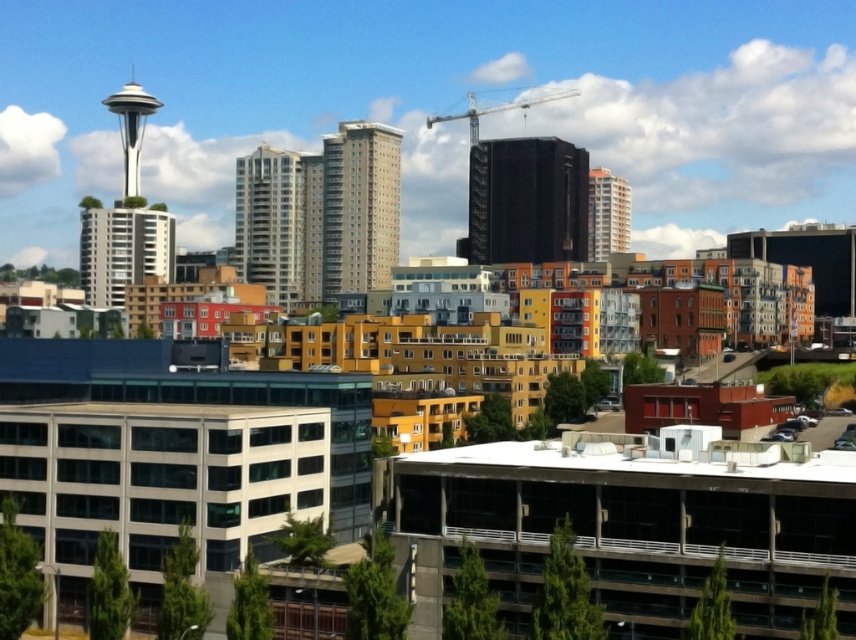
You are a city planner analyzing the urban layout. Given the coordinates provided for the black glass building at center, how does its position affect the surrounding residential buildings in terms of sunlight exposure?

The black glass building at center is located at point (527, 200), which may cast shadows on the surrounding residential buildings, potentially reducing their sunlight exposure depending on the time of day and season.

You are an urban planner reviewing this city layout. You need to place a new public park in the area. Considering the location of the matte glass building at center, where would you position the park to ensure it is accessible to both the commercial and residential zones?

The matte glass building at center is located at coordinates point (271, 224). To ensure accessibility to both commercial and residential zones, the park should be placed near the center point between these areas, possibly around the matte glass building at center to serve as a central green space.